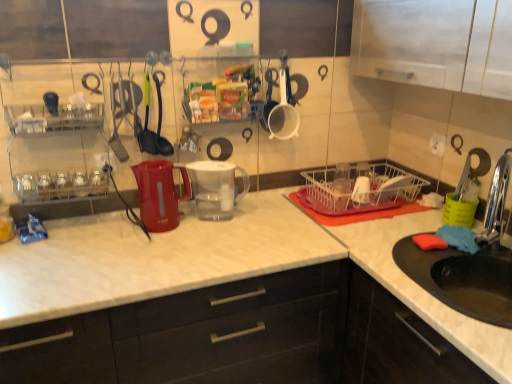
Describe the element at coordinates (283, 111) in the screenshot. I see `white matte measuring cup at upper center, acting as the 2th tableware starting from the right` at that location.

How much space does green plastic spatula at center, which is the fourth tableware in right-to-left order, occupy vertically?

The height of green plastic spatula at center, which is the fourth tableware in right-to-left order, is 13.27 inches.

Locate an element on the screen. This screenshot has height=384, width=512. transparent plastic cups at center, the 4th tableware from the left is located at coordinates (342, 178).

Describe the element at coordinates (496, 201) in the screenshot. I see `chrome metallic faucet at sink right` at that location.

This screenshot has height=384, width=512. What do you see at coordinates (224, 94) in the screenshot? I see `clear plastic shelf at center` at bounding box center [224, 94].

Where is `black matte sink at lower right, which is the first cabinetry in right-to-left order`? This screenshot has width=512, height=384. black matte sink at lower right, which is the first cabinetry in right-to-left order is located at coordinates (397, 342).

Could you measure the distance between chrome metallic faucet at sink right and black matte sink at lower right, placed as the second cabinetry when sorted from left to right?

They are 18.32 inches apart.

Is point (500, 220) closer to viewer compared to point (414, 327)?

Yes, it is in front of point (414, 327).

Looking at their sizes, would you say chrome metallic faucet at sink right is wider or thinner than black matte sink at lower right, placed as the second cabinetry when sorted from left to right?

Clearly, chrome metallic faucet at sink right has less width compared to black matte sink at lower right, placed as the second cabinetry when sorted from left to right.

From the image's perspective, is chrome metallic faucet at sink right under black matte sink at lower right, placed as the second cabinetry when sorted from left to right?

Actually, chrome metallic faucet at sink right appears above black matte sink at lower right, placed as the second cabinetry when sorted from left to right, in the image.

Do you think green plastic spatula at center, placed as the first tableware when sorted from left to right, is within transparent plastic cups at center, the 4th tableware from the left, or outside of it?

green plastic spatula at center, placed as the first tableware when sorted from left to right, is outside transparent plastic cups at center, the 4th tableware from the left.

From a real-world perspective, is green plastic spatula at center, which is the fourth tableware in right-to-left order, located beneath transparent plastic cups at center, the 4th tableware from the left?

No, from a real-world perspective, green plastic spatula at center, which is the fourth tableware in right-to-left order, is not below transparent plastic cups at center, the 4th tableware from the left.

Looking at this image, considering the sizes of green plastic spatula at center, placed as the first tableware when sorted from left to right, and transparent plastic cups at center, the 4th tableware from the left, in the image, is green plastic spatula at center, placed as the first tableware when sorted from left to right, wider or thinner than transparent plastic cups at center, the 4th tableware from the left,?

Clearly, green plastic spatula at center, placed as the first tableware when sorted from left to right, has more width compared to transparent plastic cups at center, the 4th tableware from the left.

From the image's perspective, is green plastic spatula at center, which is the fourth tableware in right-to-left order, above or below transparent plastic cups at center, the 4th tableware from the left?

From the image's perspective, green plastic spatula at center, which is the fourth tableware in right-to-left order, appears above transparent plastic cups at center, the 4th tableware from the left.

In terms of width, does clear plastic shelf at center look wider or thinner when compared to black matte sink at lower right, which is the first cabinetry in right-to-left order?

Clearly, clear plastic shelf at center has less width compared to black matte sink at lower right, which is the first cabinetry in right-to-left order.

From a real-world perspective, between clear plastic shelf at center and black matte sink at lower right, which is the first cabinetry in right-to-left order, who is vertically higher?

clear plastic shelf at center.

Is clear plastic shelf at center bigger or smaller than black matte sink at lower right, which is the first cabinetry in right-to-left order?

clear plastic shelf at center is smaller than black matte sink at lower right, which is the first cabinetry in right-to-left order.

From a real-world perspective, count 1st cabinetrys downward from the clear plastic shelf at center and point to it. Please provide its 2D coordinates.

[(397, 342)]

Is transparent plastic cups at center, which is the 1th tableware in right-to-left order, to the right of green plastic spatula at center, which is the fourth tableware in right-to-left order, from the viewer's perspective?

Yes.

Looking at this image, would you say transparent plastic cups at center, the 4th tableware from the left, is a long distance from green plastic spatula at center, which is the fourth tableware in right-to-left order?

No.

Which is in front, transparent plastic cups at center, the 4th tableware from the left, or green plastic spatula at center, which is the fourth tableware in right-to-left order?

green plastic spatula at center, which is the fourth tableware in right-to-left order, is in front.

Is matte white countertop at center, the second cabinetry in the right-to-left sequence, directly adjacent to transparent plastic water filter pitcher at center, acting as the 1th appliance starting from the right?

There is a gap between matte white countertop at center, the second cabinetry in the right-to-left sequence, and transparent plastic water filter pitcher at center, acting as the 1th appliance starting from the right.

From a real-world perspective, is matte white countertop at center, placed as the 1th cabinetry when sorted from left to right, above or below transparent plastic water filter pitcher at center, acting as the 1th appliance starting from the right?

matte white countertop at center, placed as the 1th cabinetry when sorted from left to right, is situated lower than transparent plastic water filter pitcher at center, acting as the 1th appliance starting from the right, in the real world.

Based on their positions, is matte white countertop at center, placed as the 1th cabinetry when sorted from left to right, located to the left or right of white matte measuring cup at upper center, which is the 3th tableware from left to right?

In the image, matte white countertop at center, placed as the 1th cabinetry when sorted from left to right, appears on the left side of white matte measuring cup at upper center, which is the 3th tableware from left to right.

This screenshot has height=384, width=512. In order to click on the 1st tableware to the right when counting from the matte white countertop at center, placed as the 1th cabinetry when sorted from left to right in this screenshot , I will do `click(283, 111)`.

In terms of width, does matte white countertop at center, placed as the 1th cabinetry when sorted from left to right, look wider or thinner when compared to white matte measuring cup at upper center, which is the 3th tableware from left to right?

Clearly, matte white countertop at center, placed as the 1th cabinetry when sorted from left to right, has more width compared to white matte measuring cup at upper center, which is the 3th tableware from left to right.

In the scene shown: Can you confirm if matte white countertop at center, placed as the 1th cabinetry when sorted from left to right, is bigger than white matte measuring cup at upper center, acting as the 2th tableware starting from the right?

Indeed, matte white countertop at center, placed as the 1th cabinetry when sorted from left to right, has a larger size compared to white matte measuring cup at upper center, acting as the 2th tableware starting from the right.

What's the angular difference between matte plastic kettle at center, acting as the 1th appliance starting from the left, and chrome metallic faucet at sink right's facing directions?

5.17 degrees.

The height and width of the screenshot is (384, 512). What are the coordinates of `faucet on the right of matte plastic kettle at center, acting as the 1th appliance starting from the left` in the screenshot? It's located at (496, 201).

Between matte plastic kettle at center, acting as the 1th appliance starting from the left, and chrome metallic faucet at sink right, which one appears on the right side from the viewer's perspective?

chrome metallic faucet at sink right is more to the right.

Is matte plastic kettle at center, acting as the 1th appliance starting from the left, touching chrome metallic faucet at sink right?

No, matte plastic kettle at center, acting as the 1th appliance starting from the left, is not touching chrome metallic faucet at sink right.

Identify the location of faucet lying above the black matte sink at lower right, which is the first cabinetry in right-to-left order (from the image's perspective). [496, 201].

Where is `tableware that is the 3rd object located in front of the transparent plastic cups at center, the 4th tableware from the left`? The width and height of the screenshot is (512, 384). tableware that is the 3rd object located in front of the transparent plastic cups at center, the 4th tableware from the left is located at coordinates click(147, 124).

Estimate the real-world distances between objects in this image. Which object is closer to white marble countertop at center, white matte measuring cup at upper center, which is the 3th tableware from left to right, or chrome metallic faucet at sink right?

white matte measuring cup at upper center, which is the 3th tableware from left to right, is closer to white marble countertop at center.

Consider the image. Which object lies nearer to the anchor point chrome metallic faucet at sink right, green rubber spoon at center, which appears as the 2th tableware when viewed from the left, or white matte measuring cup at upper center, acting as the 2th tableware starting from the right?

white matte measuring cup at upper center, acting as the 2th tableware starting from the right, lies closer to chrome metallic faucet at sink right than the other object.

Consider the image. Which object lies nearer to the anchor point matte plastic kettle at center, the second appliance when ordered from right to left, green rubber spoon at center, the third tableware from the right, or transparent plastic cups at center, the 4th tableware from the left?

Based on the image, green rubber spoon at center, the third tableware from the right, appears to be nearer to matte plastic kettle at center, the second appliance when ordered from right to left.

Based on the photo, which object lies nearer to the anchor point white matte measuring cup at upper center, acting as the 2th tableware starting from the right, white marble countertop at center or matte plastic kettle at center, the second appliance when ordered from right to left?

matte plastic kettle at center, the second appliance when ordered from right to left, lies closer to white matte measuring cup at upper center, acting as the 2th tableware starting from the right, than the other object.

Based on the photo, considering their positions, is chrome metallic faucet at sink right positioned closer to green plastic spatula at center, placed as the first tableware when sorted from left to right, than transparent plastic water filter pitcher at center, the 2th appliance positioned from the left?

Based on the image, transparent plastic water filter pitcher at center, the 2th appliance positioned from the left, appears to be nearer to green plastic spatula at center, placed as the first tableware when sorted from left to right.

Looking at the image, which one is located closer to green plastic spatula at center, which is the fourth tableware in right-to-left order, white wire basket at center or black matte sink at lower right, placed as the second cabinetry when sorted from left to right?

Among the two, white wire basket at center is located nearer to green plastic spatula at center, which is the fourth tableware in right-to-left order.

Estimate the real-world distances between objects in this image. Which object is closer to white wire basket at center, clear plastic shelf at center or transparent plastic cups at center, the 4th tableware from the left?

Among the two, transparent plastic cups at center, the 4th tableware from the left, is located nearer to white wire basket at center.

Based on their spatial positions, is transparent plastic water filter pitcher at center, acting as the 1th appliance starting from the right, or chrome metallic faucet at sink right further from black matte sink at lower right, placed as the second cabinetry when sorted from left to right?

Based on the image, transparent plastic water filter pitcher at center, acting as the 1th appliance starting from the right, appears to be further to black matte sink at lower right, placed as the second cabinetry when sorted from left to right.

Image resolution: width=512 pixels, height=384 pixels. I want to click on basket between white matte measuring cup at upper center, acting as the 2th tableware starting from the right, and white marble countertop at center in the up-down direction, so [x=360, y=193].

Locate an element on the screen. This screenshot has width=512, height=384. cabinetry situated between white marble countertop at center and black matte sink at lower right, placed as the second cabinetry when sorted from left to right, from left to right is located at coordinates (244, 337).

Identify the location of appliance between matte plastic kettle at center, acting as the 1th appliance starting from the left, and transparent plastic cups at center, the 4th tableware from the left, from left to right. (215, 188).

Locate an element on the screen. basket situated between clear plastic shelf at center and chrome metallic faucet at sink right from left to right is located at coordinates (360, 193).